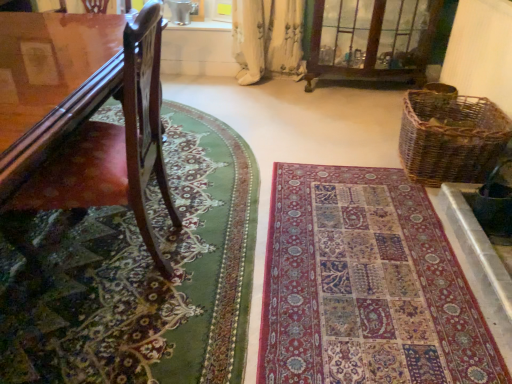
Question: Is clear glass cabinet at upper center a part of multicolored woven rug at center, marked as the 1th mat in a right-to-left arrangement?

Choices:
 (A) yes
 (B) no

Answer: (B)

Question: Could you tell me if multicolored woven rug at center, marked as the 1th mat in a right-to-left arrangement, is turned towards clear glass cabinet at upper center?

Choices:
 (A) yes
 (B) no

Answer: (B)

Question: Considering the relative positions of multicolored woven rug at center, the 2th mat when ordered from left to right, and clear glass cabinet at upper center in the image provided, is multicolored woven rug at center, the 2th mat when ordered from left to right, to the left of clear glass cabinet at upper center from the viewer's perspective?

Choices:
 (A) yes
 (B) no

Answer: (A)

Question: Considering the relative sizes of multicolored woven rug at center, the 2th mat when ordered from left to right, and clear glass cabinet at upper center in the image provided, is multicolored woven rug at center, the 2th mat when ordered from left to right, taller than clear glass cabinet at upper center?

Choices:
 (A) yes
 (B) no

Answer: (B)

Question: Is multicolored woven rug at center, marked as the 1th mat in a right-to-left arrangement, positioned in front of clear glass cabinet at upper center?

Choices:
 (A) yes
 (B) no

Answer: (A)

Question: From a real-world perspective, is green woolen rug at lower left, marked as the 1th mat in a left-to-right arrangement, physically located above or below shiny brown wood chair at left?

Choices:
 (A) above
 (B) below

Answer: (B)

Question: Based on their sizes in the image, would you say green woolen rug at lower left, acting as the second mat starting from the right, is bigger or smaller than shiny brown wood chair at left?

Choices:
 (A) big
 (B) small

Answer: (B)

Question: Considering the positions of green woolen rug at lower left, marked as the 1th mat in a left-to-right arrangement, and shiny brown wood chair at left in the image, is green woolen rug at lower left, marked as the 1th mat in a left-to-right arrangement, taller or shorter than shiny brown wood chair at left?

Choices:
 (A) short
 (B) tall

Answer: (A)

Question: Looking at their shapes, would you say green woolen rug at lower left, acting as the second mat starting from the right, is wider or thinner than shiny brown wood chair at left?

Choices:
 (A) wide
 (B) thin

Answer: (A)

Question: In terms of width, does green woolen rug at lower left, acting as the second mat starting from the right, look wider or thinner when compared to clear glass cabinet at upper center?

Choices:
 (A) wide
 (B) thin

Answer: (A)

Question: From the image's perspective, is green woolen rug at lower left, marked as the 1th mat in a left-to-right arrangement, above or below clear glass cabinet at upper center?

Choices:
 (A) below
 (B) above

Answer: (A)

Question: From a real-world perspective, is green woolen rug at lower left, marked as the 1th mat in a left-to-right arrangement, physically located above or below clear glass cabinet at upper center?

Choices:
 (A) above
 (B) below

Answer: (B)

Question: Considering the positions of point (173, 317) and point (416, 23), is point (173, 317) closer or farther from the camera than point (416, 23)?

Choices:
 (A) closer
 (B) farther

Answer: (A)

Question: Based on their positions, is clear glass cabinet at upper center located to the left or right of shiny brown wood chair at left?

Choices:
 (A) left
 (B) right

Answer: (B)

Question: Considering the positions of clear glass cabinet at upper center and shiny brown wood chair at left in the image, is clear glass cabinet at upper center bigger or smaller than shiny brown wood chair at left?

Choices:
 (A) small
 (B) big

Answer: (A)